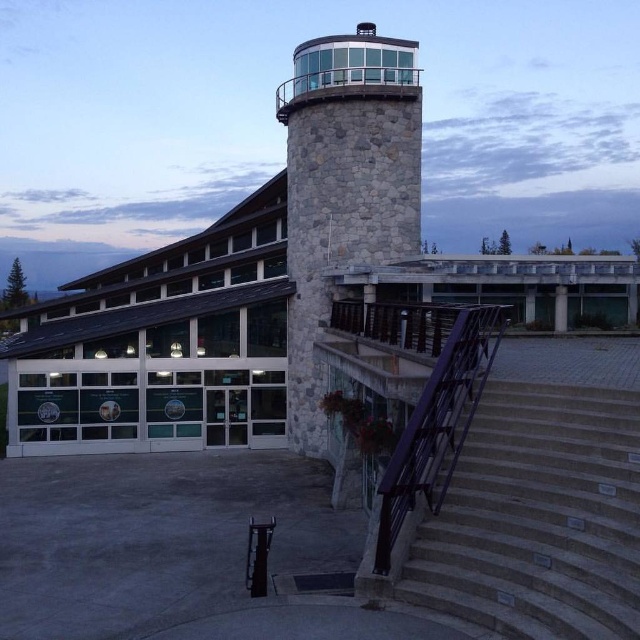
Question: Among these objects, which one is nearest to the camera?

Choices:
 (A) stone/tile control tower at center
 (B) gray concrete stairs at lower right

Answer: (B)

Question: Does gray concrete stairs at lower right appear on the right side of stone/tile control tower at center?

Choices:
 (A) yes
 (B) no

Answer: (A)

Question: Which of the following is the closest to the observer?

Choices:
 (A) gray concrete stairs at lower right
 (B) stone/tile control tower at center

Answer: (A)

Question: Does gray concrete stairs at lower right have a smaller size compared to stone/tile control tower at center?

Choices:
 (A) no
 (B) yes

Answer: (B)

Question: Is gray concrete stairs at lower right above stone/tile control tower at center?

Choices:
 (A) no
 (B) yes

Answer: (A)

Question: Which point appears closest to the camera in this image?

Choices:
 (A) (342, 237)
 (B) (474, 444)

Answer: (B)